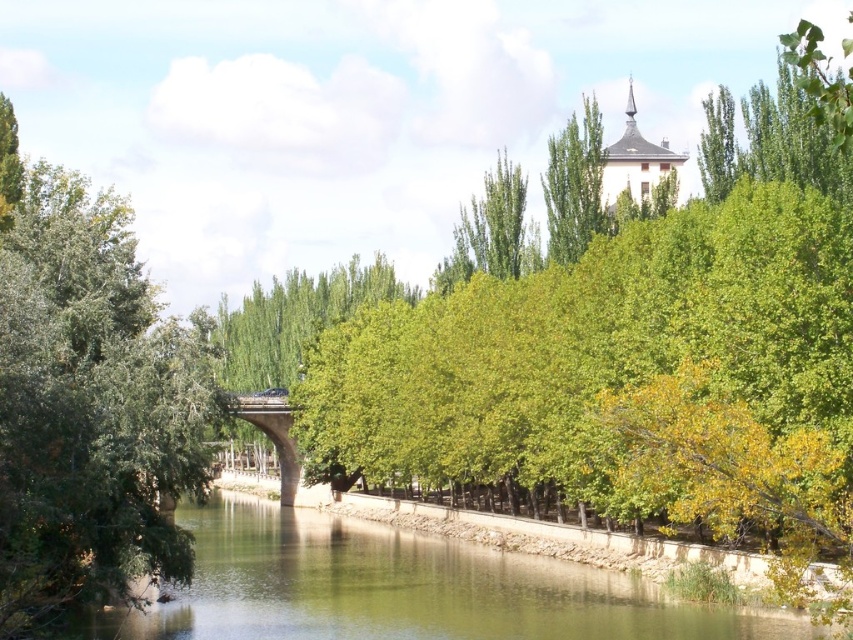
You are a hiker who wants to cross the river. You see the green smooth water at center and the concrete bridge at center. Which one should you use to safely cross the river?

You should use the concrete bridge at center to safely cross the river because the green smooth water at center is positioned under it, indicating the bridge spans the river.

You are standing at the riverside and want to take a photo of a specific point. The point you want to capture is located at coordinates point (22, 372). Given that your camera has a maximum focus range of 60 meters, will you be able to focus on this point?

The distance of point (22, 372) from camera is 58.51 meters, which is within the camera maximum focus range of 60 meters. So yes, you can focus on this point.